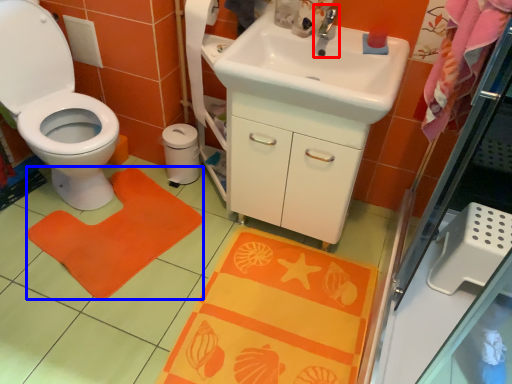
Question: Which point is closer to the camera, tap (highlighted by a red box) or doormat (highlighted by a blue box)?

Choices:
 (A) tap
 (B) doormat

Answer: (A)